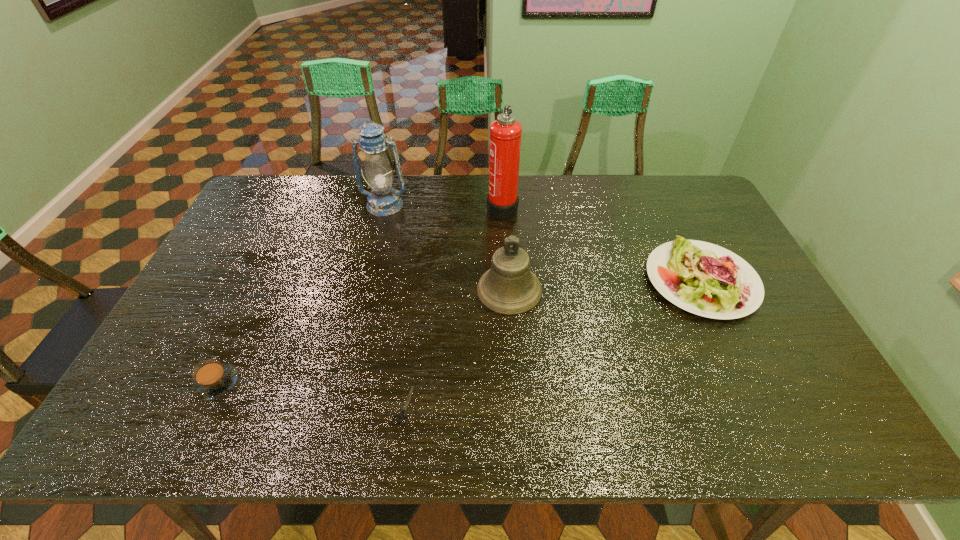
I want to click on free location that satisfies the following two spatial constraints: 1. on the back side of the third tallest object; 2. on the front-facing side of the fire extinguisher, so click(504, 206).

The height and width of the screenshot is (540, 960). I want to click on vacant region that satisfies the following two spatial constraints: 1. on the front-facing side of the rightmost object; 2. on the right side of the second object from left to right, so click(366, 281).

Locate an element on the screen. free spot that satisfies the following two spatial constraints: 1. on the back side of the shortest object; 2. on the right side of the rightmost object is located at coordinates (420, 281).

In order to click on vacant point that satisfies the following two spatial constraints: 1. on the front-facing side of the fire extinguisher; 2. on the front side of the fifth tallest object in this screenshot , I will do `click(512, 383)`.

Where is `free location that satisfies the following two spatial constraints: 1. on the front-facing side of the bell; 2. on the left side of the tallest object`? The height and width of the screenshot is (540, 960). free location that satisfies the following two spatial constraints: 1. on the front-facing side of the bell; 2. on the left side of the tallest object is located at coordinates (507, 290).